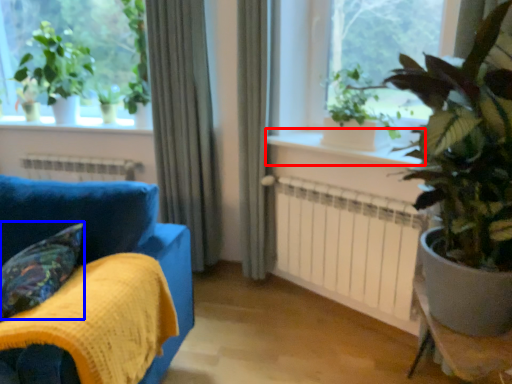
Question: Among these objects, which one is farthest to the camera, window sill (highlighted by a red box) or pillow (highlighted by a blue box)?

Choices:
 (A) window sill
 (B) pillow

Answer: (A)